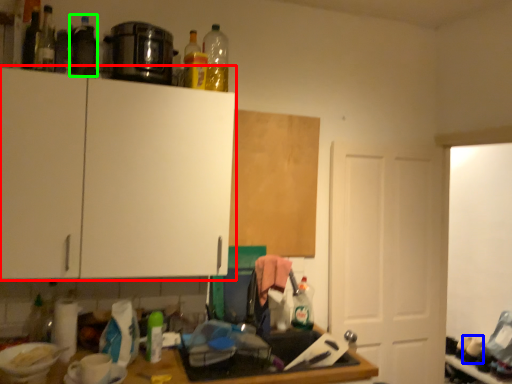
Question: Which is farther away from cabinetry (highlighted by a red box)? bottle (highlighted by a blue box) or bottle (highlighted by a green box)?

Choices:
 (A) bottle
 (B) bottle

Answer: (A)